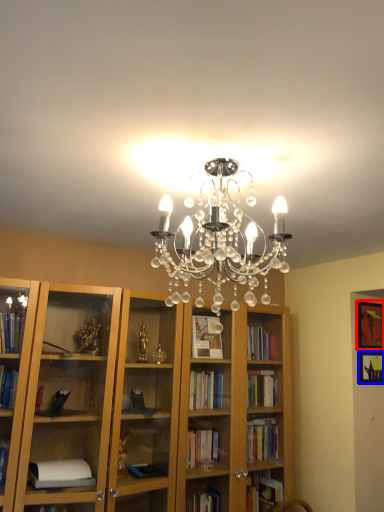
Question: Which point is further to the camera, picture frame (highlighted by a red box) or picture frame (highlighted by a blue box)?

Choices:
 (A) picture frame
 (B) picture frame

Answer: (A)